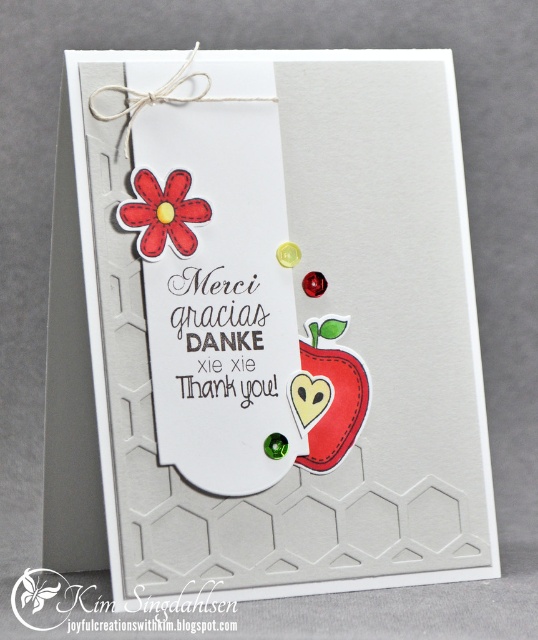
Does matte paper tag at center appear on the left side of matte white tag at center?

Incorrect, matte paper tag at center is not on the left side of matte white tag at center.

Can you confirm if matte paper tag at center is positioned below matte white tag at center?

Yes.

This screenshot has width=538, height=640. What do you see at coordinates (284, 324) in the screenshot? I see `matte paper tag at center` at bounding box center [284, 324].

What are the coordinates of `matte paper tag at center` in the screenshot? It's located at (284, 324).

Is matte white tag at center to the left of matte red flower at upper left from the viewer's perspective?

In fact, matte white tag at center is to the right of matte red flower at upper left.

Does matte white tag at center lie in front of matte red flower at upper left?

Yes, it is in front of matte red flower at upper left.

Does point (272, 124) come behind point (181, 232)?

Yes, point (272, 124) is farther from viewer.

This screenshot has width=538, height=640. What are the coordinates of `matte white tag at center` in the screenshot? It's located at (215, 275).

Is point (318, 289) farther from viewer compared to point (192, 211)?

That is True.

Does matte paper tag at center have a larger size compared to matte red flower at upper left?

Yes.

What do you see at coordinates (284, 324) in the screenshot?
I see `matte paper tag at center` at bounding box center [284, 324].

At what (x,y) coordinates should I click in order to perform the action: click on matte paper tag at center. Please return your answer as a coordinate pair (x, y). Looking at the image, I should click on (284, 324).